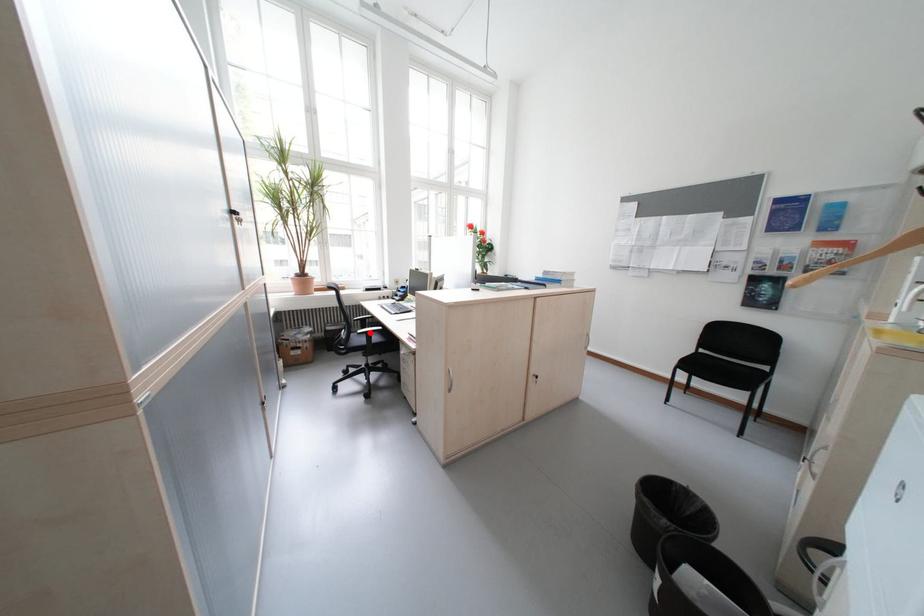
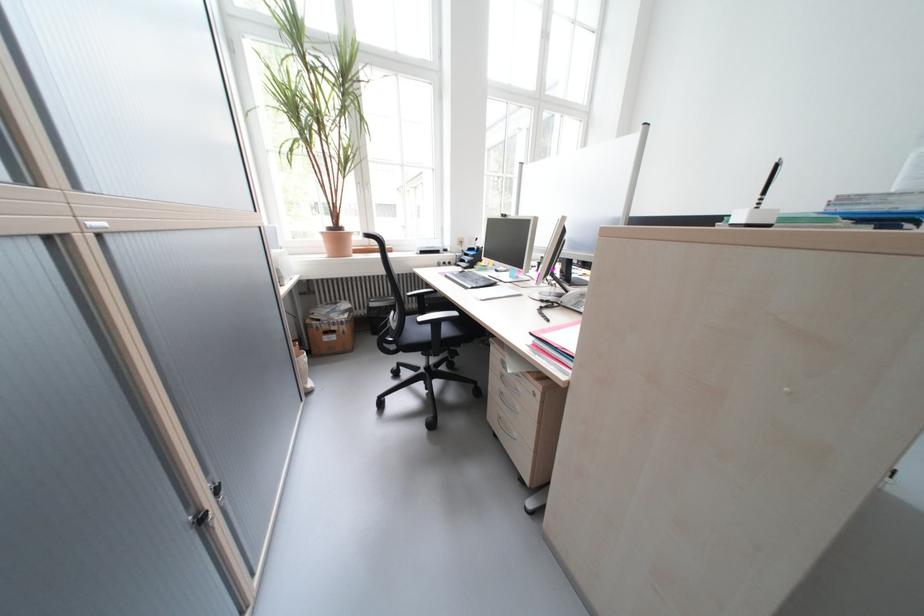
Question: I am providing you with two images of the same scene from different viewpoints. Image1 has a red point marked. In image2, the corresponding 3D location appears at what relative position? Reply with the corresponding letter.

Choices:
 (A) Closer
 (B) Farther

Answer: (A)